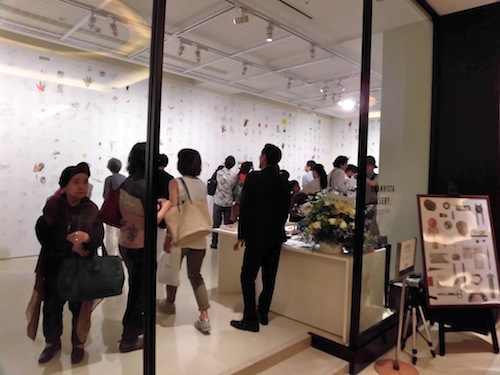
Locate an element on the screen. The height and width of the screenshot is (375, 500). white desk is located at coordinates [332, 287].